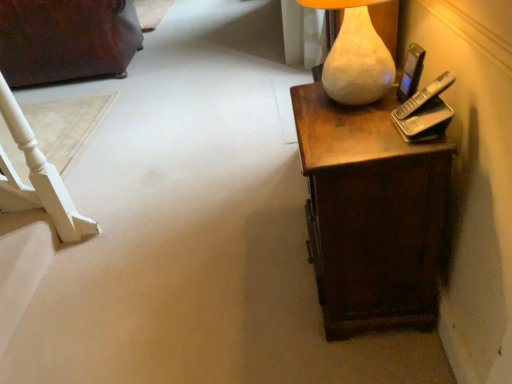
Question: Is matte white lamp at upper right oriented towards brown wood desk at right?

Choices:
 (A) yes
 (B) no

Answer: (B)

Question: Is matte white lamp at upper right bigger than brown wood desk at right?

Choices:
 (A) no
 (B) yes

Answer: (A)

Question: Would you say matte white lamp at upper right is a long distance from brown wood desk at right?

Choices:
 (A) yes
 (B) no

Answer: (B)

Question: Is brown wood desk at right completely or partially inside matte white lamp at upper right?

Choices:
 (A) no
 (B) yes

Answer: (A)

Question: Does matte white lamp at upper right have a lesser height compared to brown wood desk at right?

Choices:
 (A) no
 (B) yes

Answer: (B)

Question: Considering the positions of point (422, 59) and point (78, 46), is point (422, 59) closer or farther from the camera than point (78, 46)?

Choices:
 (A) farther
 (B) closer

Answer: (B)

Question: Based on their positions, is black plastic mobile phone at upper right located to the left or right of dark brown wood dresser at upper left?

Choices:
 (A) right
 (B) left

Answer: (A)

Question: From the image's perspective, relative to dark brown wood dresser at upper left, is black plastic mobile phone at upper right above or below?

Choices:
 (A) below
 (B) above

Answer: (A)

Question: Considering the positions of black plastic mobile phone at upper right and dark brown wood dresser at upper left in the image, is black plastic mobile phone at upper right wider or thinner than dark brown wood dresser at upper left?

Choices:
 (A) thin
 (B) wide

Answer: (A)

Question: In terms of height, does matte white lamp at upper right look taller or shorter compared to brown wood desk at right?

Choices:
 (A) short
 (B) tall

Answer: (A)

Question: Relative to brown wood desk at right, is matte white lamp at upper right in front or behind?

Choices:
 (A) behind
 (B) front

Answer: (B)

Question: Looking at their shapes, would you say matte white lamp at upper right is wider or thinner than brown wood desk at right?

Choices:
 (A) wide
 (B) thin

Answer: (B)

Question: From the image's perspective, relative to brown wood desk at right, is matte white lamp at upper right above or below?

Choices:
 (A) above
 (B) below

Answer: (A)

Question: From the image's perspective, is brown wood desk at right above or below matte white lamp at upper right?

Choices:
 (A) below
 (B) above

Answer: (A)

Question: From a real-world perspective, is brown wood desk at right positioned above or below matte white lamp at upper right?

Choices:
 (A) above
 (B) below

Answer: (B)